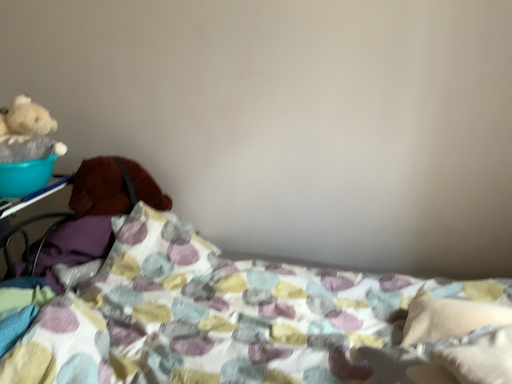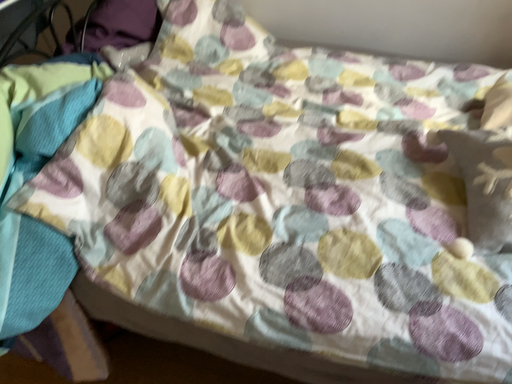
Question: How did the camera likely rotate when shooting the video?

Choices:
 (A) rotated downward
 (B) rotated upward

Answer: (A)